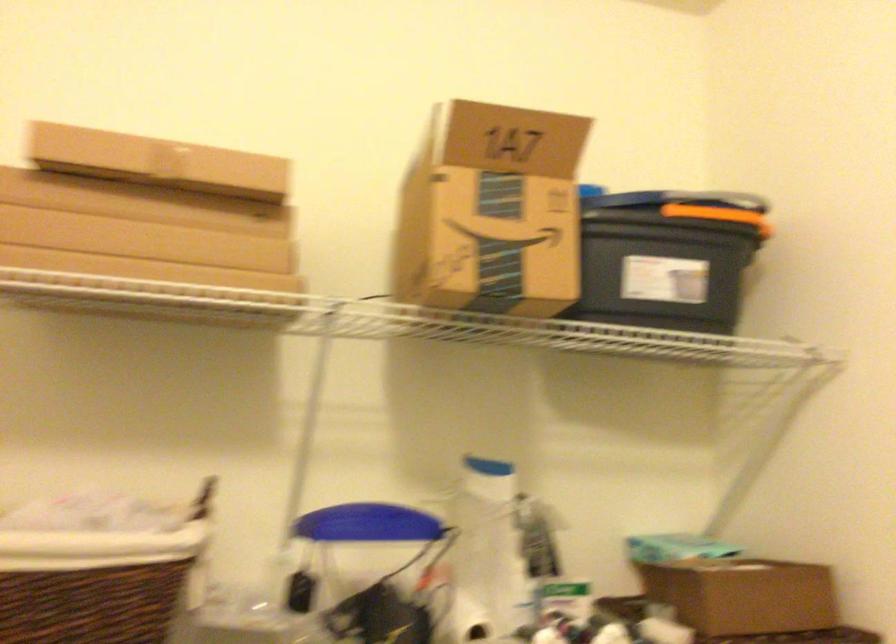
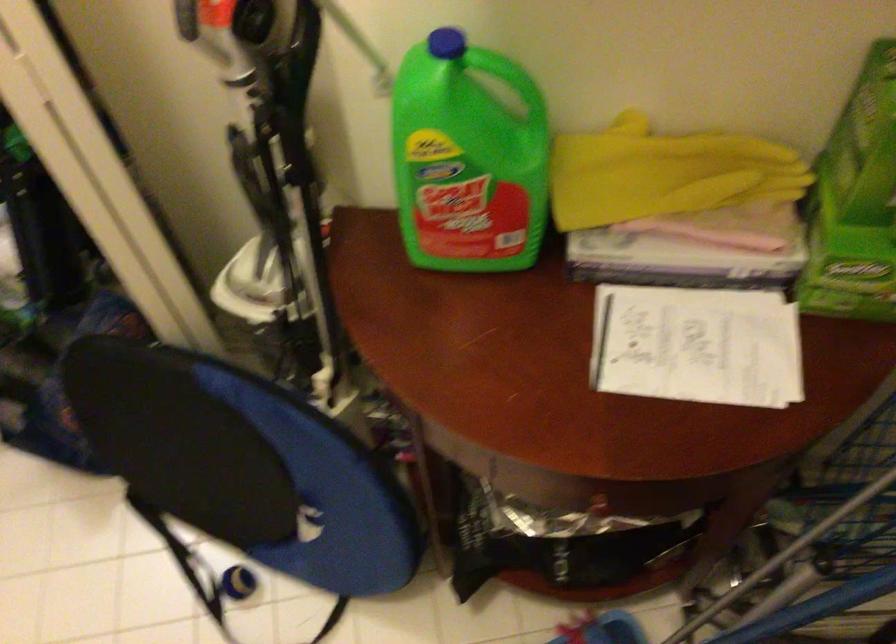
Based on the continuous images, in which direction is the camera rotating?

The camera rotated toward right-down.